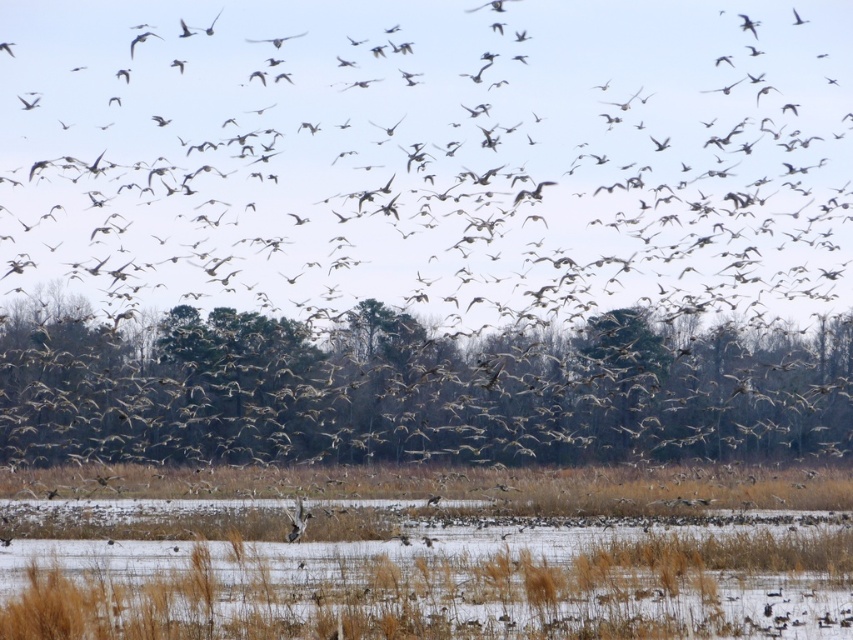
You are an ornithologist observing the birds in the marsh. You notice two groups of birds in the image. One group is labeled as brown feathered birds at center and the other as brown feathered bird at upper left. Based on their positions, which group is flying at a higher altitude?

The brown feathered birds at center has a greater height compared to brown feathered bird at upper left, so the brown feathered birds at center are flying at a higher altitude.

You are a bird flying in the marshy landscape scene. You see two points in the sky, point 1 at coordinates point (194, 362) and point 2 at coordinates point (3, 51). Which point is closer to you as you fly towards the marsh?

Point (194, 362) is in front of point (3, 51), so the point closer to you as you fly towards the marsh is point (194, 362).

Consider the image. You are a birdwatcher trying to capture a photo of the brown feathered birds at center and the brown grass at lower center. Based on the scene, which object would appear larger in your camera viewfinder?

The brown feathered birds at center might be wider than brown grass at lower center, so they would appear larger in the viewfinder.